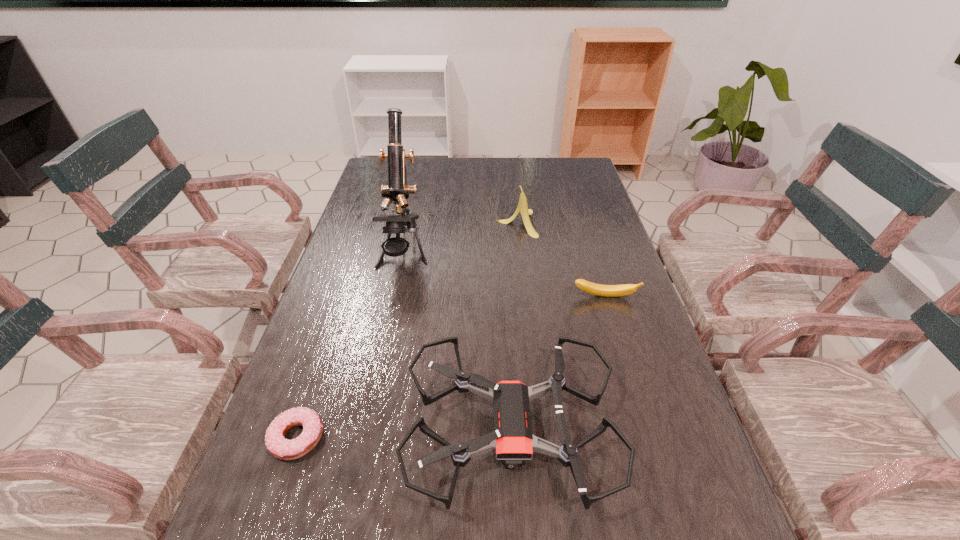
Locate an element on the screen. Image resolution: width=960 pixels, height=540 pixels. the fourth object from right to left is located at coordinates point(397,190).

At what (x,y) coordinates should I click in order to perform the action: click on the tallest object. Please return your answer as a coordinate pair (x, y). The height and width of the screenshot is (540, 960). Looking at the image, I should click on (397, 190).

Locate an element on the screen. the farther banana is located at coordinates (522, 208).

The height and width of the screenshot is (540, 960). Find the location of `the left banana`. the left banana is located at coordinates (522, 208).

Identify the location of the third tallest object. (512, 439).

You are a GUI agent. You are given a task and a screenshot of the screen. Output one action in this format:
    pyautogui.click(x=<x>, y=<y>)
    Task: Click on the right banana
    This screenshot has height=540, width=960.
    Given the screenshot: What is the action you would take?
    pyautogui.click(x=592, y=288)

Where is `the nearer banana`? The height and width of the screenshot is (540, 960). the nearer banana is located at coordinates (592, 288).

Locate an element on the screen. The width and height of the screenshot is (960, 540). the leftmost object is located at coordinates (279, 447).

At what (x,y) coordinates should I click in order to perform the action: click on doughnut. Please return your answer as a coordinate pair (x, y). Image resolution: width=960 pixels, height=540 pixels. Looking at the image, I should click on pos(279,447).

The width and height of the screenshot is (960, 540). I want to click on free space located 0.260m through the eyepiece of the microscope, so click(x=381, y=360).